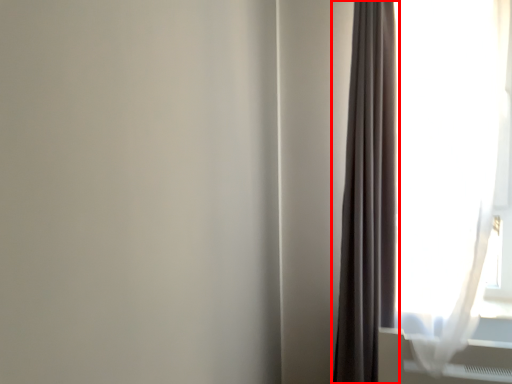
Question: From the image, what is the correct spatial relationship of curtain (annotated by the red box) in relation to curtain?

Choices:
 (A) left
 (B) right

Answer: (A)